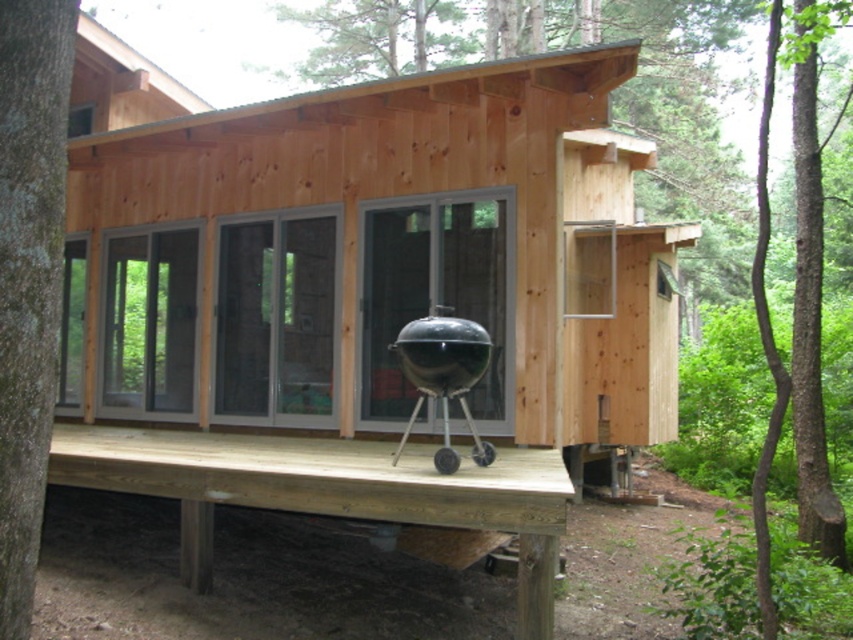
Question: Which point is closer to the camera taking this photo?

Choices:
 (A) (457, 371)
 (B) (283, 458)

Answer: (A)

Question: Does natural wood cabin at center have a greater width compared to natural wood deck at center?

Choices:
 (A) yes
 (B) no

Answer: (B)

Question: Considering the real-world distances, which object is farthest from the brown rough bark tree at left?

Choices:
 (A) natural wood cabin at center
 (B) natural wood deck at center

Answer: (A)

Question: Which object is positioned closest to the natural wood deck at center?

Choices:
 (A) green leafy tree at center
 (B) brown rough bark tree at left
 (C) natural wood cabin at center

Answer: (B)

Question: Is natural wood cabin at center in front of green leafy tree at center?

Choices:
 (A) yes
 (B) no

Answer: (B)

Question: Is green leafy tree at center bigger than brown rough bark tree at left?

Choices:
 (A) no
 (B) yes

Answer: (B)